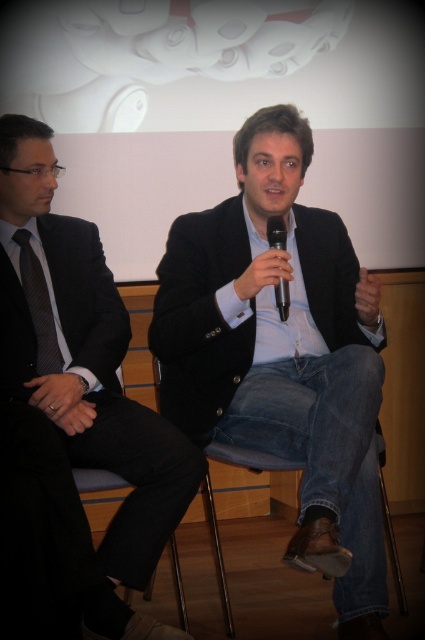
You are an event organizer who needs to place a new speaker between the matte black suit at center and the black plastic microphone at center. Based on their current positions, which side of the microphone should you place the new speaker to maintain the existing seating arrangement?

The matte black suit at center is positioned on the left side of black plastic microphone at center. To maintain the existing seating arrangement, the new speaker should be placed to the right side of the microphone, as the current speaker in the matte black suit is already on the left side.

You are an event organizer who needs to ensure all microphone cables are visible to the audience. The dark gray textured tie at left might be obstructing the view of the black plastic microphone at center. Can you confirm if the tie is larger than the microphone?

The dark gray textured tie at left is bigger than the black plastic microphone at center, so it could potentially block the view of the microphone from certain angles.

You are a photographer trying to capture a candid shot of both individuals in the scene. You notice two specific points marked in the image. The first point is at coordinates point (36, 337) and the second is at point (286, 240). Which of these points is positioned further back in the scene?

Point (36, 337) is behind point (286, 240), so it is positioned further back in the scene.